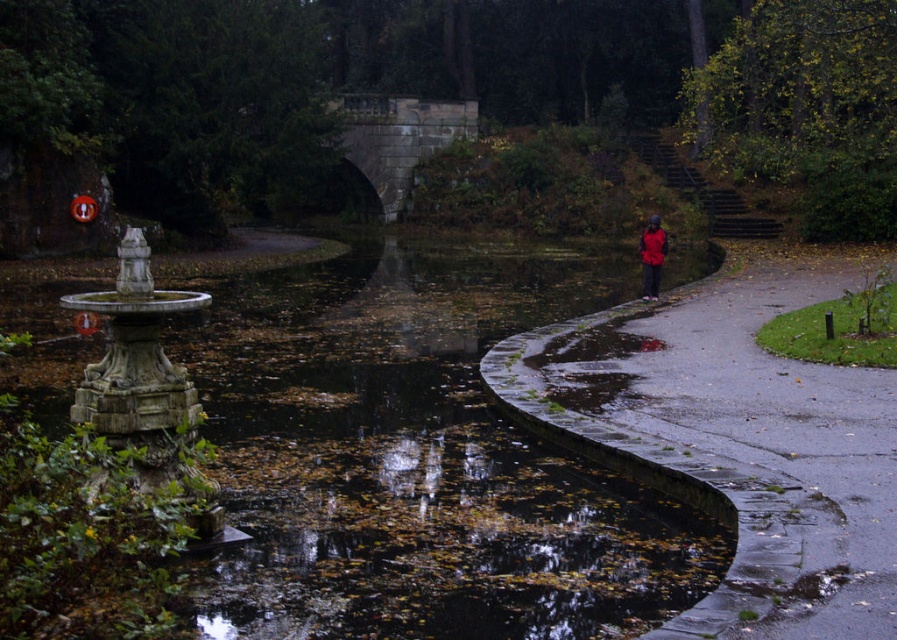
Which is above, smooth asphalt path at right or red matte jacket at right?

Positioned higher is red matte jacket at right.

Is point (694, 604) positioned in front of point (649, 221)?

Yes, point (694, 604) is in front of point (649, 221).

Between point (698, 362) and point (647, 244), which one is positioned in front?

Positioned in front is point (698, 362).

Identify the location of smooth asphalt path at right. The image size is (897, 640). (747, 444).